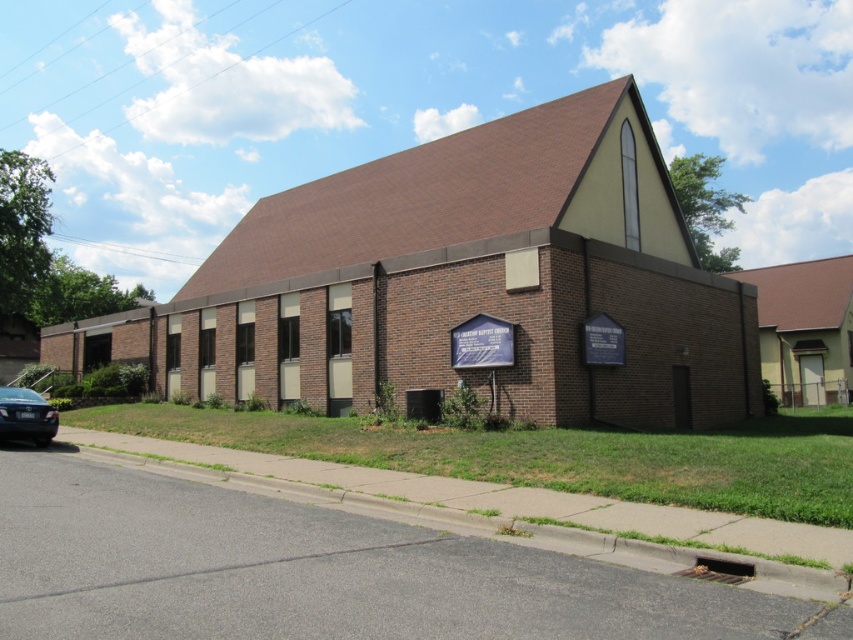
Question: In this image, where is brown brick church at center located relative to shiny black sedan at lower left?

Choices:
 (A) above
 (B) below

Answer: (A)

Question: From the image, what is the correct spatial relationship of brown brick church at center in relation to shiny black sedan at lower left?

Choices:
 (A) below
 (B) above

Answer: (B)

Question: Does brown brick church at center come in front of shiny black sedan at lower left?

Choices:
 (A) yes
 (B) no

Answer: (A)

Question: Which object appears closest to the camera in this image?

Choices:
 (A) brown brick church at center
 (B) shiny black sedan at lower left

Answer: (A)